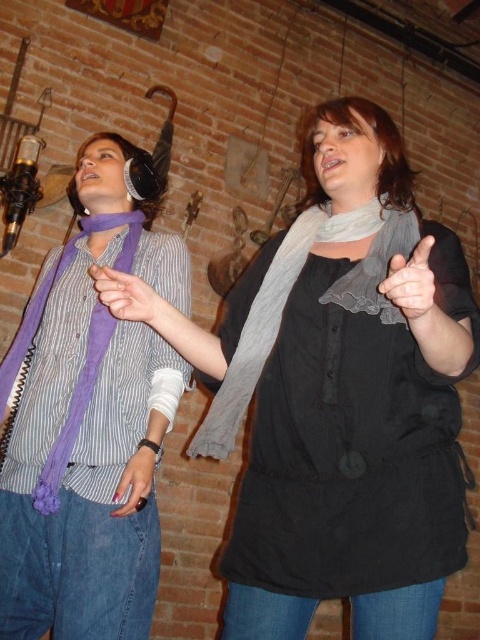
Is gray textured scarf at center shorter than purple silky scarf at left?

Indeed, gray textured scarf at center has a lesser height compared to purple silky scarf at left.

Does gray textured scarf at center have a smaller size compared to purple silky scarf at left?

Yes, gray textured scarf at center is smaller than purple silky scarf at left.

Does point (328, 204) lie behind point (131, 250)?

That is False.

Locate an element on the screen. Image resolution: width=480 pixels, height=640 pixels. gray textured scarf at center is located at coordinates (319, 298).

Which is more to the right, purple silky scarf at left or matte black hand at center?

Positioned to the right is matte black hand at center.

Between point (48, 500) and point (416, 308), which one is positioned behind?

Positioned behind is point (48, 500).

Identify the location of purple silky scarf at left. (55, 282).

Is purple soft scarf at left bigger than purple silky scarf at left?

Indeed, purple soft scarf at left has a larger size compared to purple silky scarf at left.

Image resolution: width=480 pixels, height=640 pixels. I want to click on purple soft scarf at left, so click(x=88, y=417).